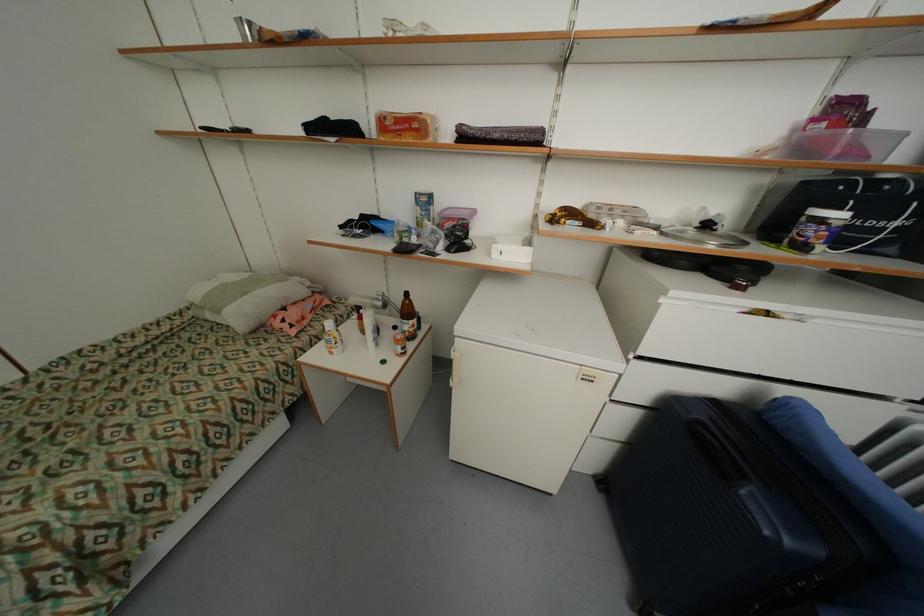
This screenshot has width=924, height=616. Describe the element at coordinates (714, 452) in the screenshot. I see `the blue suitcase handle` at that location.